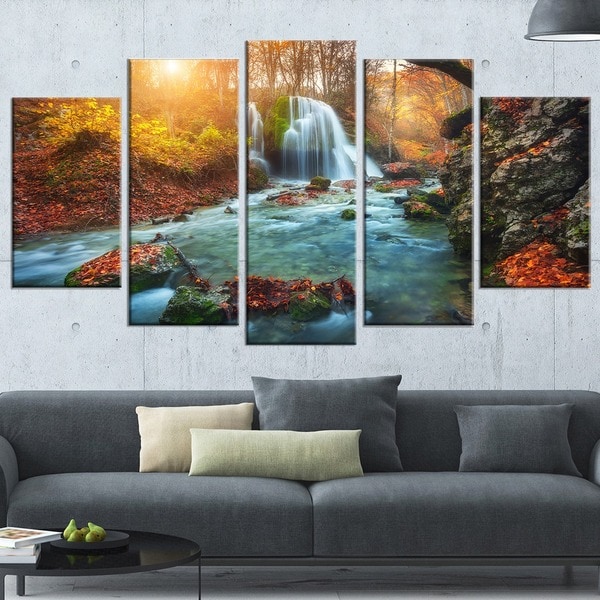
The image size is (600, 600). I want to click on wall, so click(x=516, y=332).